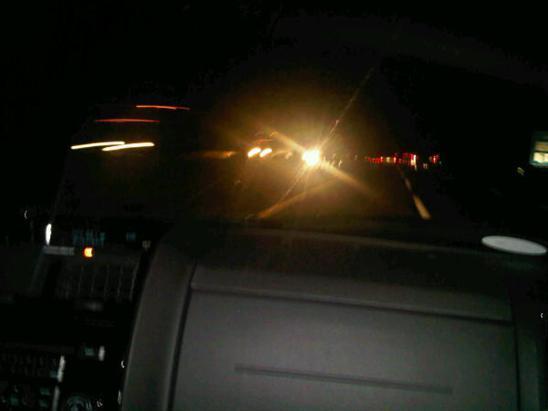
I want to click on screen, so click(x=90, y=236).